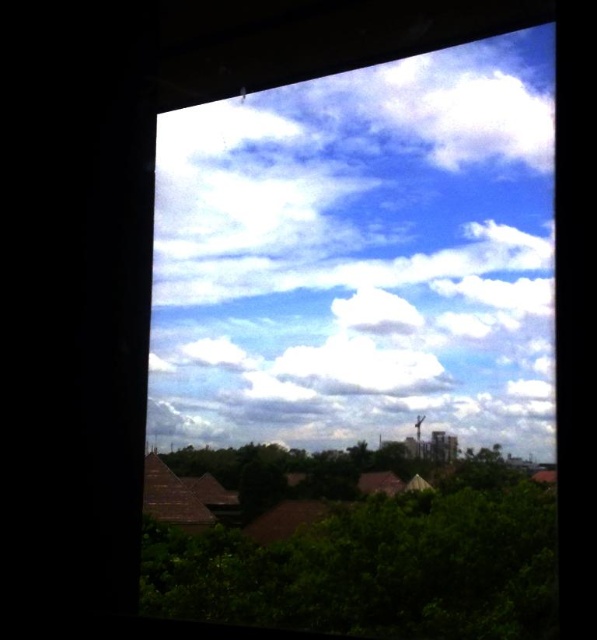
Is white fluffy cloud at upper center to the right of green leafy tree at lower left from the viewer's perspective?

Correct, you'll find white fluffy cloud at upper center to the right of green leafy tree at lower left.

Which is in front, point (298, 353) or point (242, 608)?

Point (242, 608) is more forward.

The width and height of the screenshot is (597, 640). Find the location of `white fluffy cloud at upper center`. white fluffy cloud at upper center is located at coordinates (361, 257).